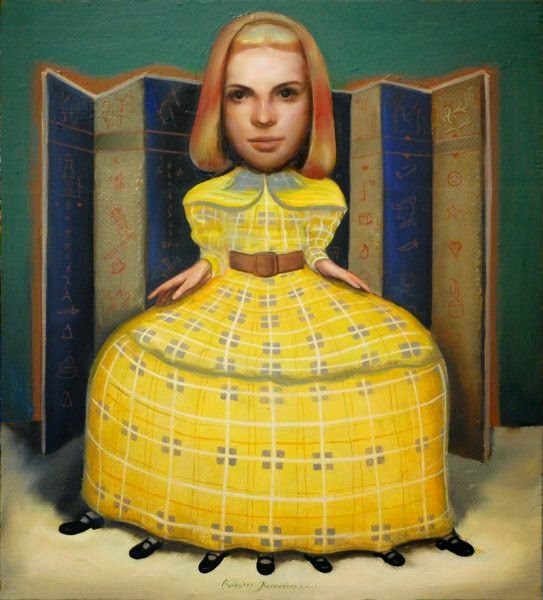
Image resolution: width=543 pixels, height=600 pixels. What are the coordinates of `moveable wall` in the screenshot? It's located at (x=427, y=203).